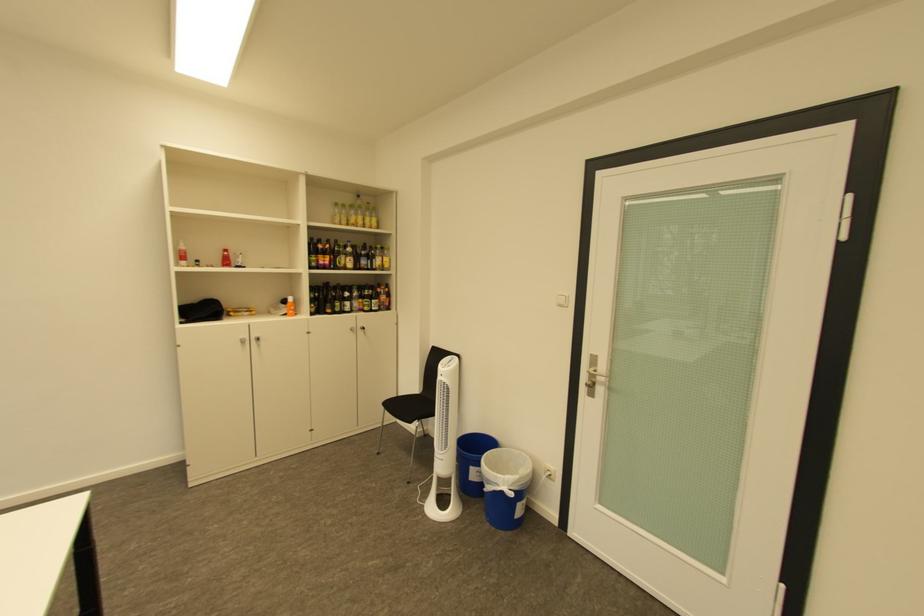
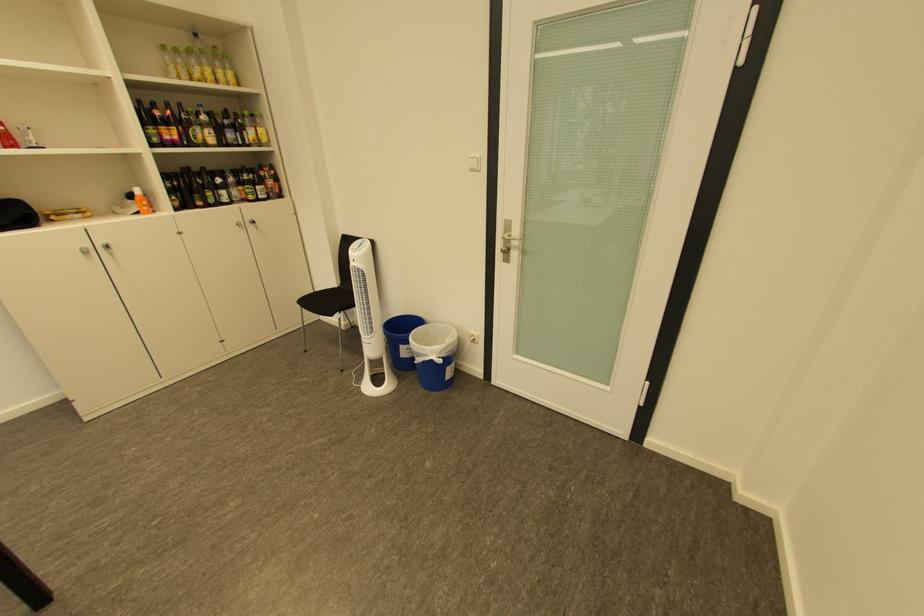
Locate, in the second image, the point that corresponds to point 499,483 in the first image.

(429, 355)